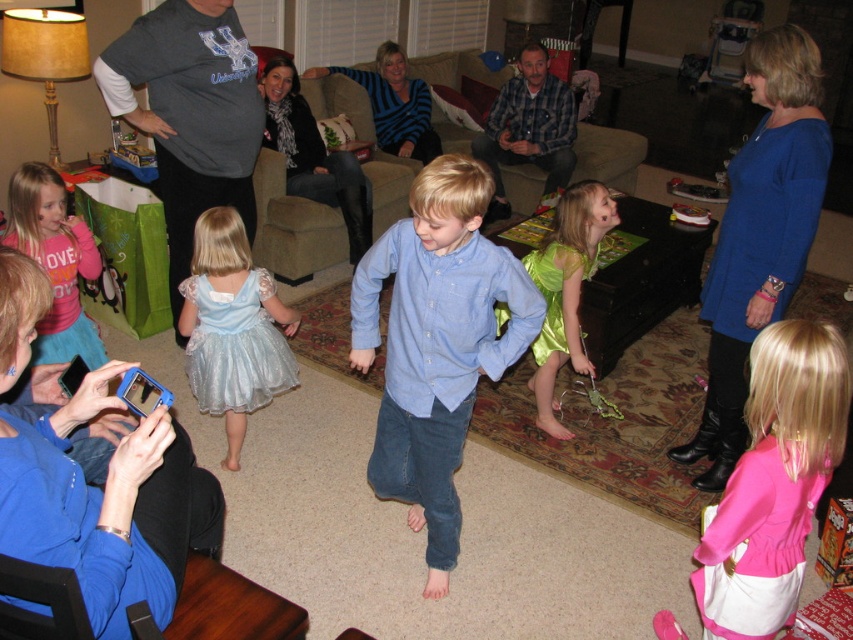
Question: Which point is farther to the camera?

Choices:
 (A) (146, 573)
 (B) (177, 307)

Answer: (B)

Question: Is dark gray t-shirt at upper left thinner than green satin dress at center?

Choices:
 (A) no
 (B) yes

Answer: (A)

Question: Is blue denim shirt at center positioned behind shiny silver dress at lower left?

Choices:
 (A) no
 (B) yes

Answer: (A)

Question: Which of the following is the farthest from the observer?

Choices:
 (A) (544, 362)
 (B) (479, 326)

Answer: (A)

Question: Is blue glitter dress at lower left closer to camera compared to shiny silver dress at lower left?

Choices:
 (A) yes
 (B) no

Answer: (A)

Question: Which object is positioned farthest from the dark gray t-shirt at upper left?

Choices:
 (A) blue glitter dress at lower left
 (B) shiny silver dress at lower left
 (C) pink satin dress at lower right
 (D) green satin dress at center

Answer: (C)